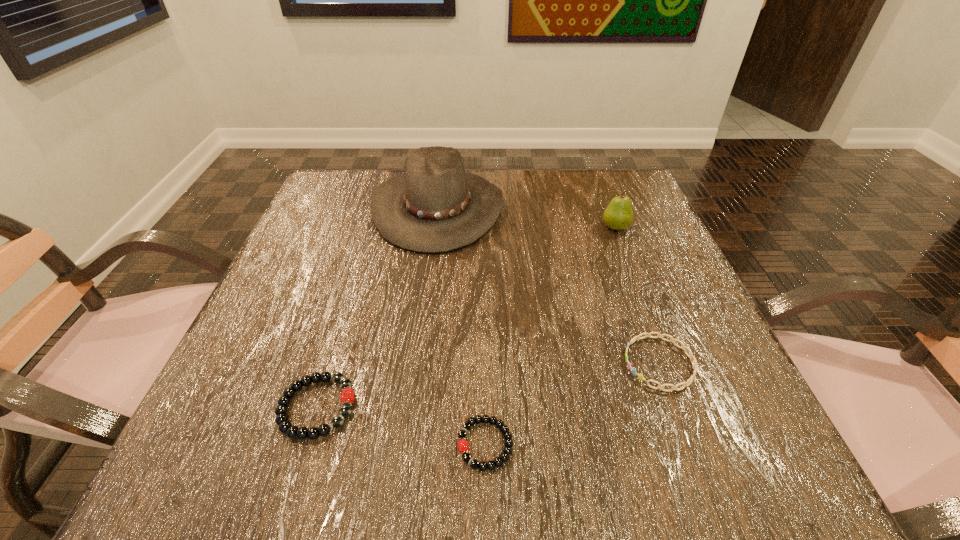
Where is `free area in between the leftmost bracelet and the shortest bracelet`? This screenshot has height=540, width=960. free area in between the leftmost bracelet and the shortest bracelet is located at coordinates (401, 426).

Identify the location of unoccupied area between the hat and the pear. The height and width of the screenshot is (540, 960). (527, 218).

Locate an element on the screen. unoccupied position between the leftmost bracelet and the rightmost bracelet is located at coordinates (489, 386).

Locate an element on the screen. vacant point located between the shortest bracelet and the hat is located at coordinates (462, 326).

Image resolution: width=960 pixels, height=540 pixels. In order to click on vacant area that lies between the fourth shortest object and the leftmost bracelet in this screenshot , I will do `click(467, 318)`.

Where is `blank region between the second bracelet from left to right and the hat`? This screenshot has width=960, height=540. blank region between the second bracelet from left to right and the hat is located at coordinates coord(462,326).

The height and width of the screenshot is (540, 960). What are the coordinates of `vacant area that lies between the tallest object and the leftmost bracelet` in the screenshot? It's located at (377, 308).

Locate an element on the screen. free spot between the shortest bracelet and the hat is located at coordinates (462, 326).

At what (x,y) coordinates should I click in order to perform the action: click on vacant space that's between the tallest object and the third tallest object. Please return your answer as a coordinate pair (x, y). The width and height of the screenshot is (960, 540). Looking at the image, I should click on (377, 308).

The height and width of the screenshot is (540, 960). I want to click on object that ranks as the second closest to the pear, so click(x=694, y=364).